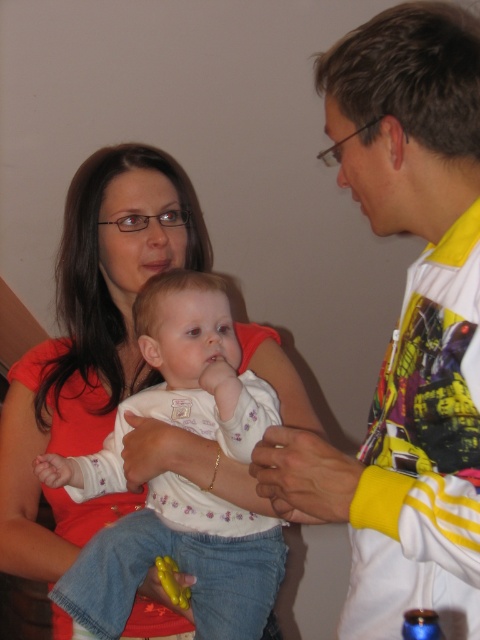
Question: Is yellow/white jacket at right smaller than matte orange shirt at upper left?

Choices:
 (A) yes
 (B) no

Answer: (A)

Question: Is yellow/white jacket at right thinner than matte orange shirt at upper left?

Choices:
 (A) yes
 (B) no

Answer: (A)

Question: Which object is farther from the camera taking this photo?

Choices:
 (A) matte orange shirt at upper left
 (B) yellow/white jacket at right

Answer: (A)

Question: Which of the following is the farthest from the observer?

Choices:
 (A) (456, 256)
 (B) (186, 246)

Answer: (B)

Question: In this image, where is yellow/white jacket at right located relative to matte orange shirt at upper left?

Choices:
 (A) above
 (B) below

Answer: (A)